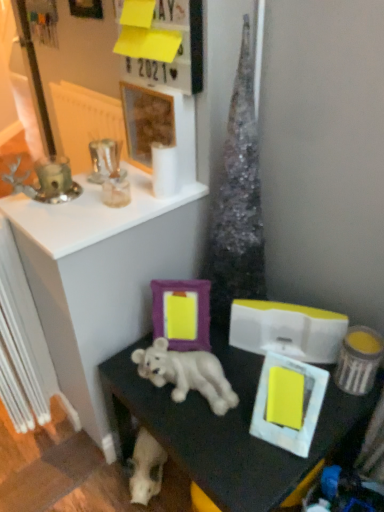
Question: Can you see white matte picture frame at lower right, which is counted as the fourth picture frame, starting from the back, touching wooden frame at upper center, acting as the 3th picture frame starting from the back?

Choices:
 (A) yes
 (B) no

Answer: (B)

Question: Does white matte picture frame at lower right, arranged as the first picture frame when viewed from the right, turn towards wooden frame at upper center, the second picture frame when ordered from left to right?

Choices:
 (A) no
 (B) yes

Answer: (A)

Question: From a real-world perspective, is white matte picture frame at lower right, acting as the 1th picture frame starting from the bottom, on top of wooden frame at upper center, which appears as the third picture frame when viewed from the right?

Choices:
 (A) no
 (B) yes

Answer: (A)

Question: Considering the relative sizes of white matte picture frame at lower right, marked as the 4th picture frame in a left-to-right arrangement, and wooden frame at upper center, which appears as the third picture frame when viewed from the right, in the image provided, is white matte picture frame at lower right, marked as the 4th picture frame in a left-to-right arrangement, thinner than wooden frame at upper center, which appears as the third picture frame when viewed from the right,?

Choices:
 (A) no
 (B) yes

Answer: (A)

Question: Can you confirm if white matte picture frame at lower right, which is counted as the fourth picture frame, starting from the back, is shorter than wooden frame at upper center, the 2th picture frame positioned from the front?

Choices:
 (A) no
 (B) yes

Answer: (B)

Question: Is yellow paper at upper center bigger or smaller than white matte dog at center?

Choices:
 (A) big
 (B) small

Answer: (A)

Question: Choose the correct answer: Is yellow paper at upper center inside white matte dog at center or outside it?

Choices:
 (A) outside
 (B) inside

Answer: (A)

Question: From the image's perspective, is yellow paper at upper center located above or below white matte dog at center?

Choices:
 (A) above
 (B) below

Answer: (A)

Question: From a real-world perspective, is yellow paper at upper center above or below white matte dog at center?

Choices:
 (A) below
 (B) above

Answer: (B)

Question: Choose the correct answer: Is metallic silver picture frame at upper left, which is the 4th picture frame in front-to-back order, inside purple matte picture frame at center, the 2th picture frame positioned from the back, or outside it?

Choices:
 (A) outside
 (B) inside

Answer: (A)

Question: Is metallic silver picture frame at upper left, positioned as the 4th picture frame in right-to-left order, wider or thinner than purple matte picture frame at center, which is the third picture frame in front-to-back order?

Choices:
 (A) wide
 (B) thin

Answer: (B)

Question: From a real-world perspective, is metallic silver picture frame at upper left, which appears as the 1th picture frame when viewed from the back, physically located above or below purple matte picture frame at center, which is the second picture frame in bottom-to-top order?

Choices:
 (A) below
 (B) above

Answer: (B)

Question: Based on their sizes in the image, would you say metallic silver picture frame at upper left, which appears as the 1th picture frame when viewed from the back, is bigger or smaller than purple matte picture frame at center, which is the second picture frame in bottom-to-top order?

Choices:
 (A) big
 (B) small

Answer: (B)

Question: From a real-world perspective, is wooden frame at upper center, the second picture frame when ordered from left to right, positioned above or below yellow paper at upper center?

Choices:
 (A) above
 (B) below

Answer: (B)

Question: Is wooden frame at upper center, the second picture frame when ordered from left to right, inside or outside of yellow paper at upper center?

Choices:
 (A) inside
 (B) outside

Answer: (B)